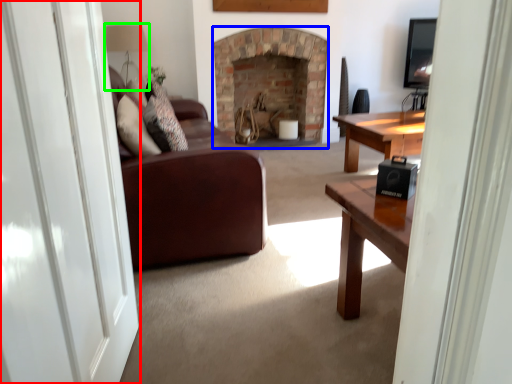
Question: Estimate the real-world distances between objects in this image. Which object is closer to screen door (highlighted by a red box), fireplace (highlighted by a blue box) or lamp (highlighted by a green box)?

Choices:
 (A) fireplace
 (B) lamp

Answer: (B)